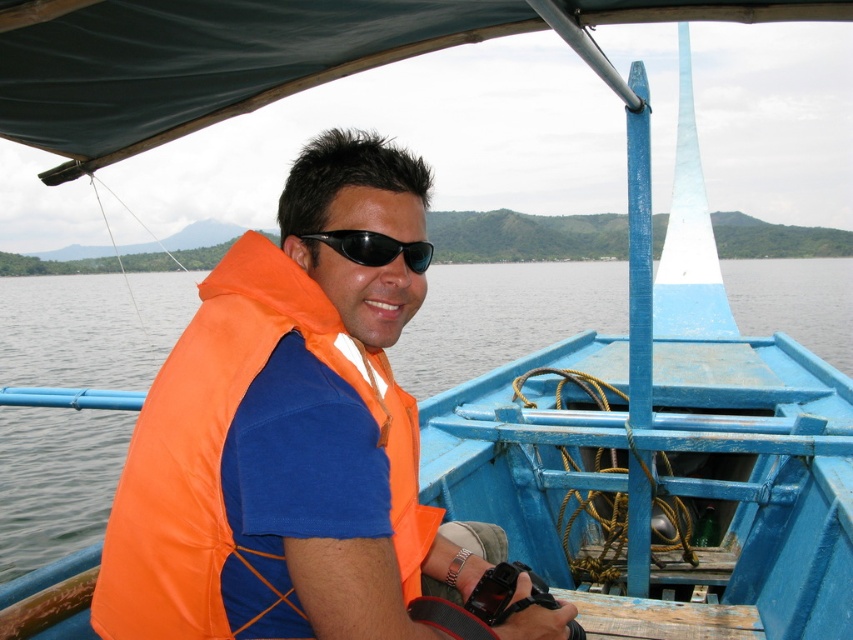
Question: Which of the following is the farthest from the observer?

Choices:
 (A) (323, 232)
 (B) (283, 269)

Answer: (A)

Question: Does orange fabric life jacket at left have a smaller size compared to black plastic sunglasses at center?

Choices:
 (A) yes
 (B) no

Answer: (B)

Question: Is orange fabric life jacket at left positioned at the back of black plastic sunglasses at center?

Choices:
 (A) yes
 (B) no

Answer: (B)

Question: Among these points, which one is farthest from the camera?

Choices:
 (A) (369, 353)
 (B) (297, 236)

Answer: (A)

Question: Can you confirm if orange fabric life jacket at left is wider than black plastic sunglasses at center?

Choices:
 (A) no
 (B) yes

Answer: (B)

Question: Which point is closer to the camera?

Choices:
 (A) orange fabric life jacket at left
 (B) black plastic sunglasses at center

Answer: (A)